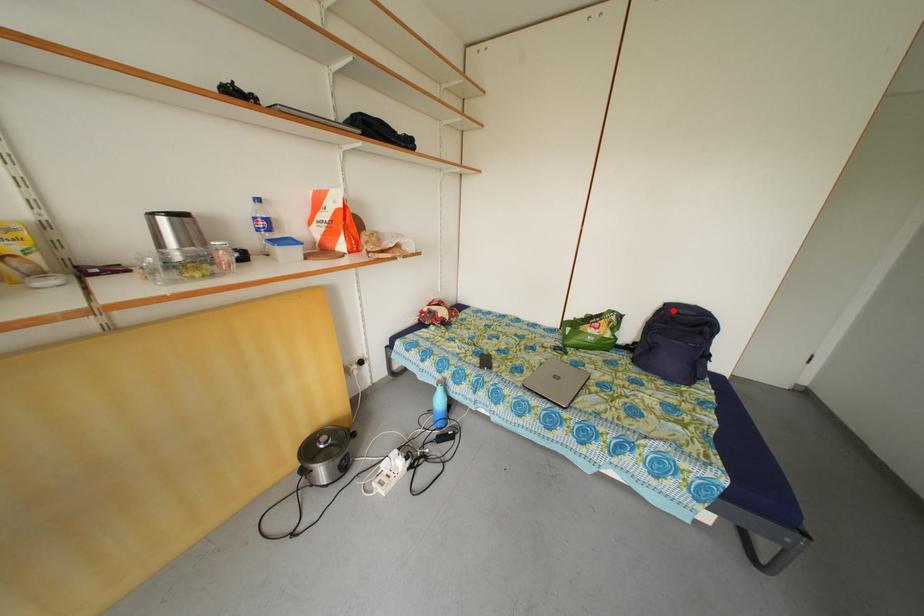
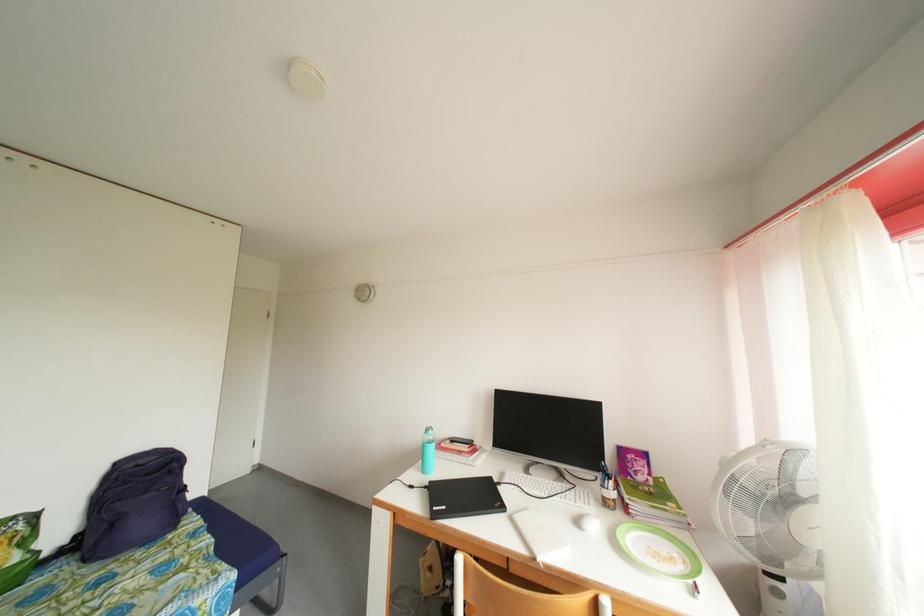
Question: I am providing you with two images of the same scene from different viewpoints. Given a red point in image1, look at the same physical point in image2. Is it:

Choices:
 (A) Closer to the viewpoint
 (B) Farther from the viewpoint

Answer: (A)